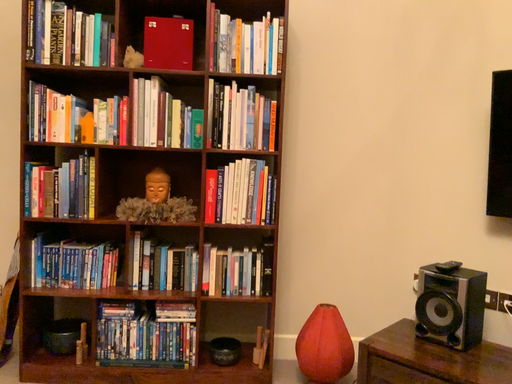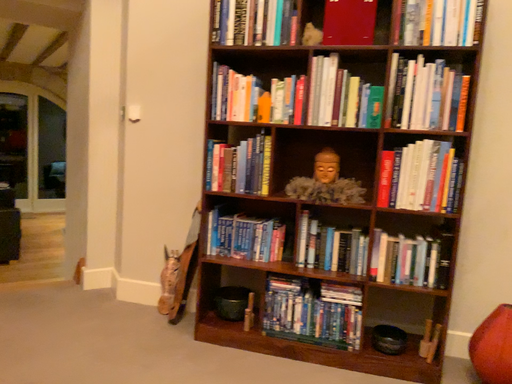
Question: How did the camera likely rotate when shooting the video?

Choices:
 (A) rotated right
 (B) rotated left

Answer: (B)